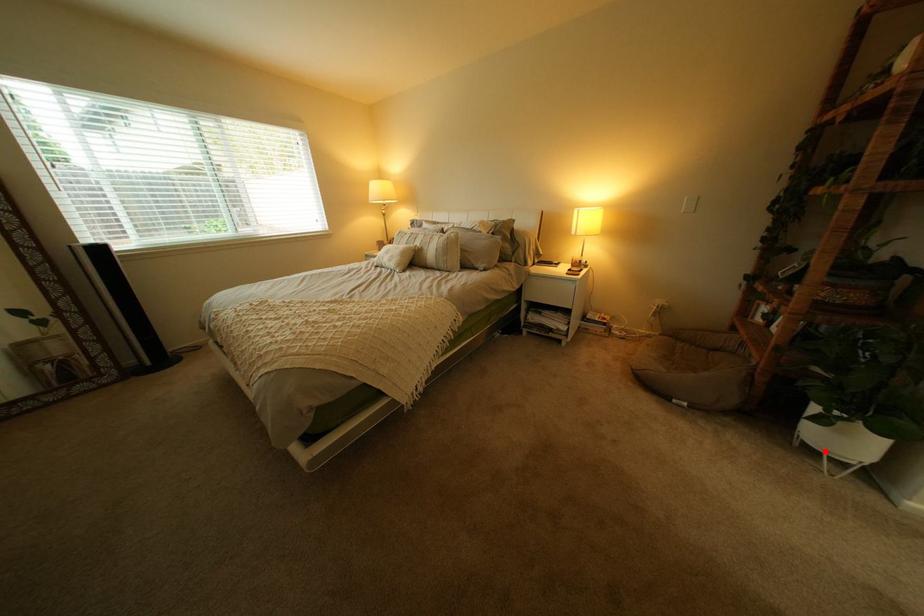
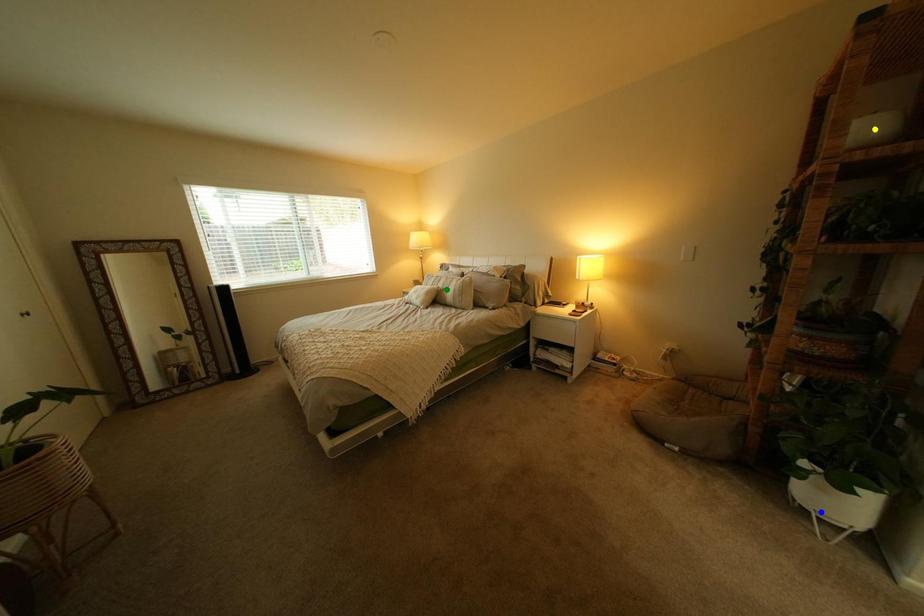
Question: I am providing you with two images of the same scene from different viewpoints. A red point is marked on the first image. You are given multiple points on the second image. Which mark in image 2 goes with the point in image 1?

Choices:
 (A) blue point
 (B) green point
 (C) yellow point

Answer: (A)